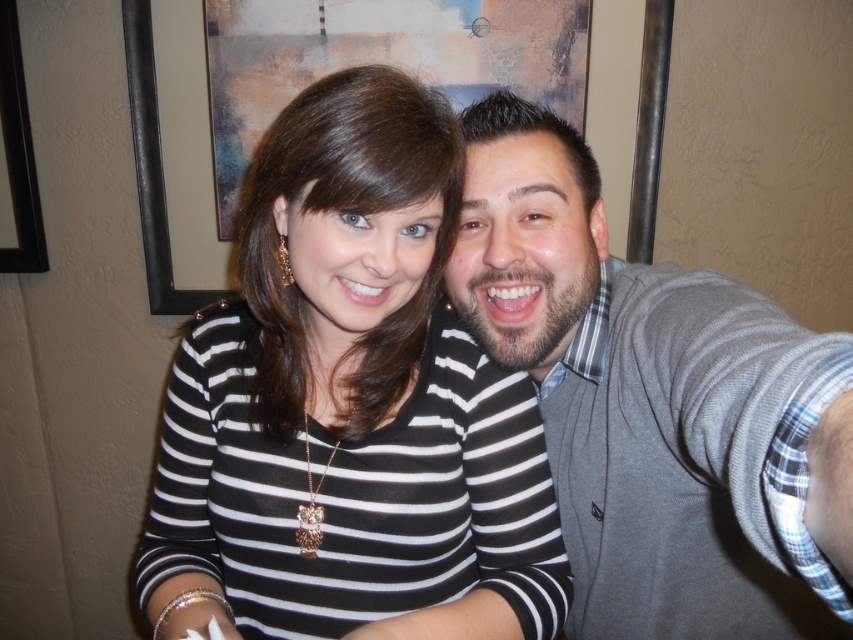
Based on the photo, which of these two, black striped shirt at center or gray sweater at right, stands shorter?

black striped shirt at center is shorter.

Is black striped shirt at center above gray sweater at right?

Incorrect, black striped shirt at center is not positioned above gray sweater at right.

Is point (485, 432) more distant than point (799, 547)?

Yes, it is behind point (799, 547).

I want to click on black striped shirt at center, so click(x=350, y=404).